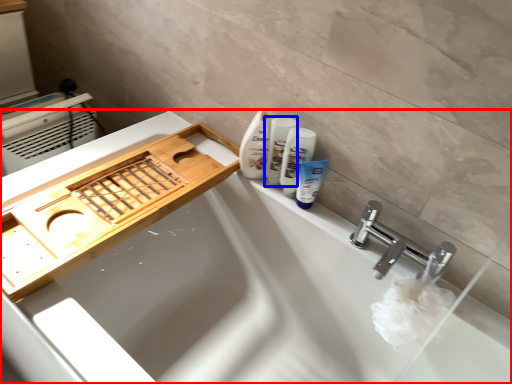
Question: Among these objects, which one is farthest to the camera, bathtub (highlighted by a red box) or toiletry (highlighted by a blue box)?

Choices:
 (A) bathtub
 (B) toiletry

Answer: (B)